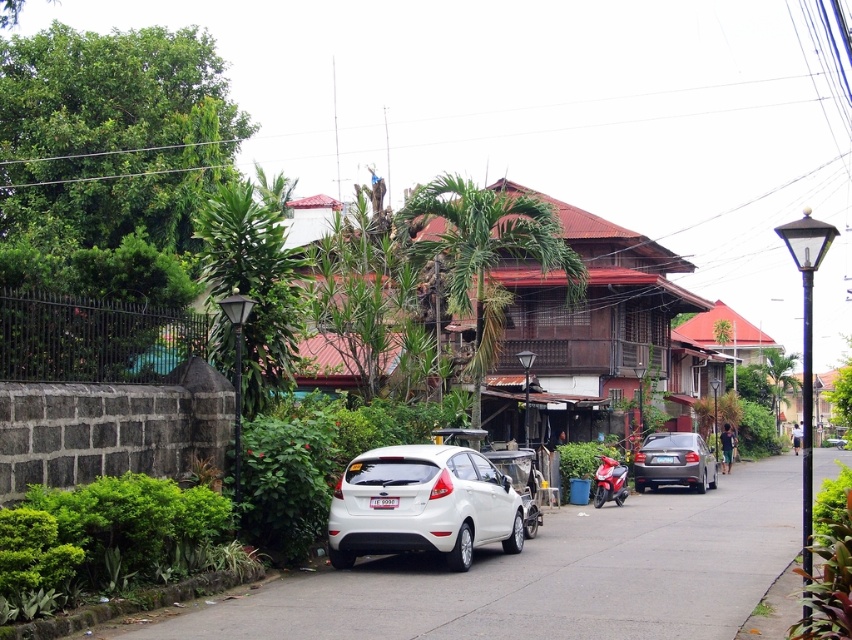
Question: Which object appears closest to the camera in this image?

Choices:
 (A) white asphalt pavement at lower center
 (B) white matte hatchback at center
 (C) satin silver sedan at center-right
 (D) green grass at lower left

Answer: (D)

Question: Among these objects, which one is farthest from the camera?

Choices:
 (A) satin silver sedan at center-right
 (B) white asphalt pavement at lower center
 (C) green grass at lower left
 (D) white matte hatchback at center

Answer: (A)

Question: Does green grass at lower left appear on the right side of satin silver sedan at center-right?

Choices:
 (A) no
 (B) yes

Answer: (A)

Question: Can you confirm if white matte hatchback at center is positioned to the left of satin silver sedan at center-right?

Choices:
 (A) yes
 (B) no

Answer: (A)

Question: Which point is closer to the camera?

Choices:
 (A) (646, 480)
 (B) (45, 618)

Answer: (B)

Question: Considering the relative positions of white asphalt pavement at lower center and green grass at lower left in the image provided, where is white asphalt pavement at lower center located with respect to green grass at lower left?

Choices:
 (A) above
 (B) below

Answer: (B)